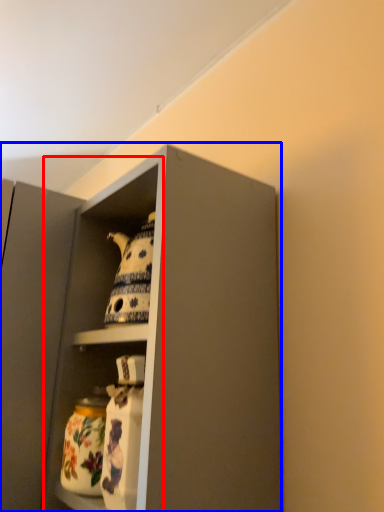
Question: Among these objects, which one is farthest to the camera, cabinet (highlighted by a red box) or cabinetry (highlighted by a blue box)?

Choices:
 (A) cabinet
 (B) cabinetry

Answer: (A)